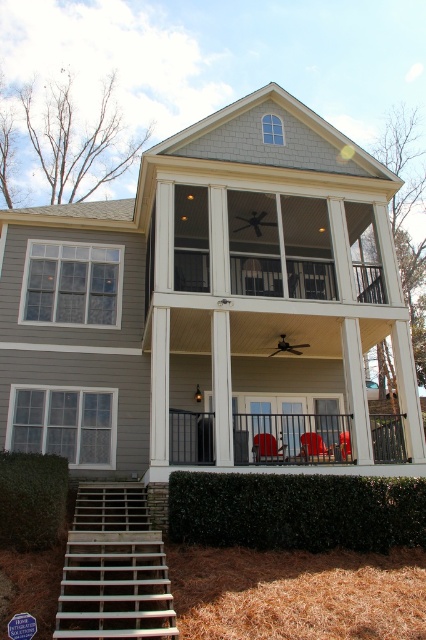
Question: Which object is the closest to the green leafy hedge at lower left?

Choices:
 (A) matte red plastic chair at center
 (B) metallic black railing at center
 (C) matte red chair at center
 (D) wooden stairs at lower left

Answer: (D)

Question: Does matte red chair at center appear over matte red plastic chair at center?

Choices:
 (A) yes
 (B) no

Answer: (A)

Question: Which of the following is the farthest from the observer?

Choices:
 (A) (313, 452)
 (B) (55, 502)

Answer: (A)

Question: Can you confirm if wooden stairs at lower left is positioned below metallic black railing at center?

Choices:
 (A) no
 (B) yes

Answer: (B)

Question: Is dark green hedge at lower center wider than wooden stairs at lower left?

Choices:
 (A) yes
 (B) no

Answer: (A)

Question: Among these points, which one is nearest to the camera?

Choices:
 (A) 273,438
 (B) 291,433
 (C) 161,545

Answer: (C)